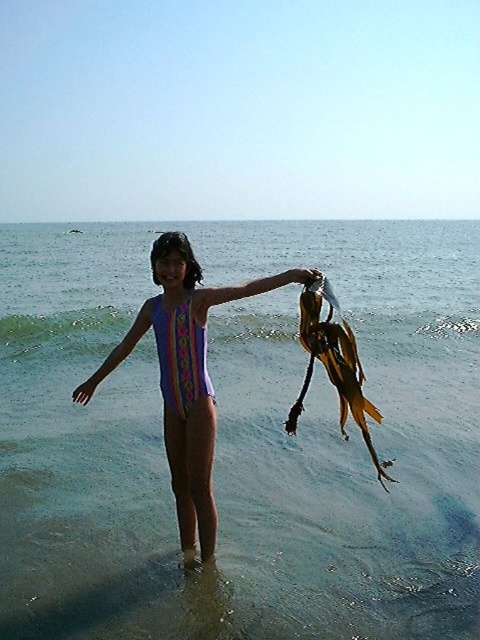
Find the location of `clear water at center`. clear water at center is located at coordinates (241, 440).

Between clear water at center and purple matte swimsuit at center, which one appears on the left side from the viewer's perspective?

clear water at center is more to the left.

Where is `clear water at center`? clear water at center is located at coordinates (241, 440).